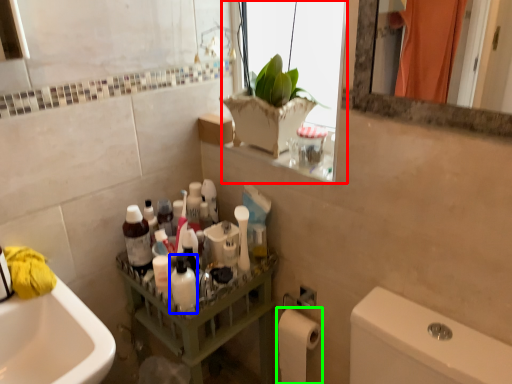
Question: Considering the real-world distances, which object is farthest from window (highlighted by a red box)? mouthwash (highlighted by a blue box) or toilet paper (highlighted by a green box)?

Choices:
 (A) mouthwash
 (B) toilet paper

Answer: (B)